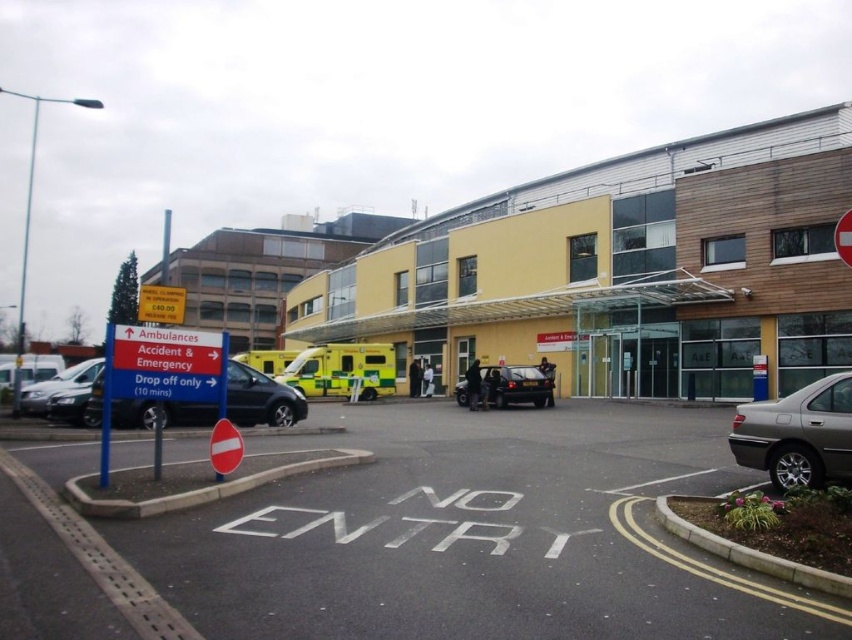
Question: Considering the real-world distances, which object is closest to the black asphalt parking lot at center?

Choices:
 (A) black metallic van at left
 (B) yellow-green plastic ambulance at center

Answer: (A)

Question: Which object appears closest to the camera in this image?

Choices:
 (A) yellow-green plastic ambulance at center
 (B) silver metallic sedan at lower right
 (C) black glossy car at center

Answer: (B)

Question: Can you confirm if silver metallic sedan at lower right is bigger than silver metallic van at left?

Choices:
 (A) no
 (B) yes

Answer: (A)

Question: Which of the following is the farthest from the observer?

Choices:
 (A) black glossy car at center
 (B) black metallic van at left
 (C) silver metallic van at left
 (D) black asphalt parking lot at center

Answer: (A)

Question: In this image, where is black asphalt parking lot at center located relative to silver metallic sedan at lower right?

Choices:
 (A) below
 (B) above

Answer: (A)

Question: Can you confirm if silver metallic sedan at lower right is bigger than black metallic van at left?

Choices:
 (A) no
 (B) yes

Answer: (B)